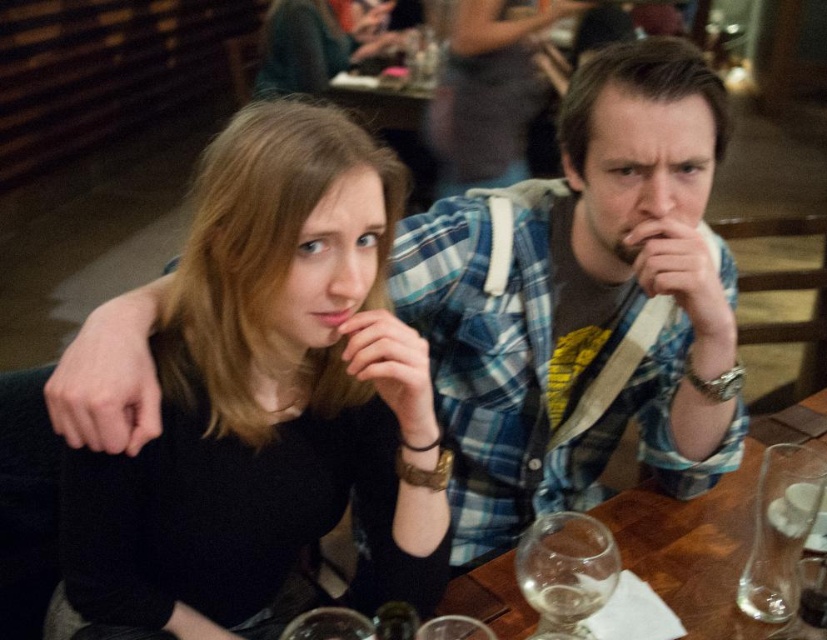
Question: Does black matte shirt at center have a larger size compared to transparent glass at lower right?

Choices:
 (A) yes
 (B) no

Answer: (A)

Question: Which of these objects is positioned closest to the transparent glass wine glass at lower center?

Choices:
 (A) black matte shirt at center
 (B) transparent glass at lower right
 (C) wooden table at center

Answer: (B)

Question: Is wooden table at center in front of transparent glass wine glass at lower center?

Choices:
 (A) yes
 (B) no

Answer: (B)

Question: Which of the following is the closest to the observer?

Choices:
 (A) wooden table at center
 (B) transparent glass wine glass at lower center
 (C) black matte shirt at center

Answer: (C)

Question: Among these points, which one is nearest to the camera?

Choices:
 (A) (797, 556)
 (B) (342, 285)
 (C) (718, 586)

Answer: (B)

Question: Considering the relative positions of wooden table at center and transparent glass at lower right in the image provided, where is wooden table at center located with respect to transparent glass at lower right?

Choices:
 (A) right
 (B) left

Answer: (A)